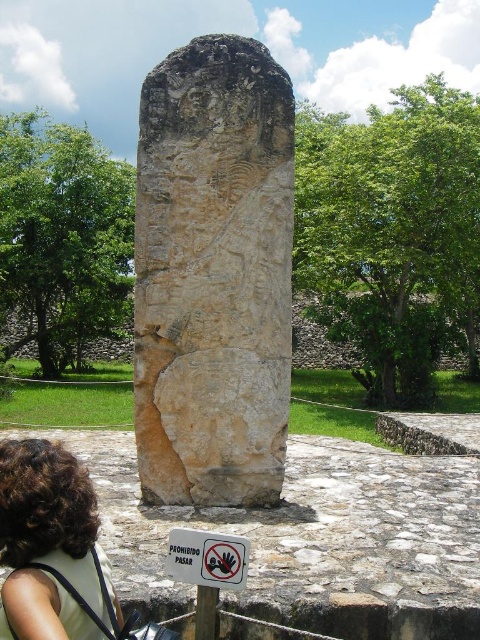
Question: Does white plastic sign at center have a lesser width compared to brown stone pillar at center?

Choices:
 (A) yes
 (B) no

Answer: (B)

Question: Which of the following is the farthest from the observer?

Choices:
 (A) (38, 589)
 (B) (207, 225)

Answer: (B)

Question: Which of the following is the farthest from the observer?

Choices:
 (A) carved stone monument at center
 (B) brown curly hair at lower left
 (C) white plastic sign at center

Answer: (A)

Question: Which point appears farthest from the camera in this image?

Choices:
 (A) (205, 634)
 (B) (239, 384)
 (C) (2, 456)

Answer: (B)

Question: Does carved stone monument at center appear over brown curly hair at lower left?

Choices:
 (A) no
 (B) yes

Answer: (B)

Question: Can you confirm if white plastic sign at center is positioned below brown stone pillar at center?

Choices:
 (A) no
 (B) yes

Answer: (A)